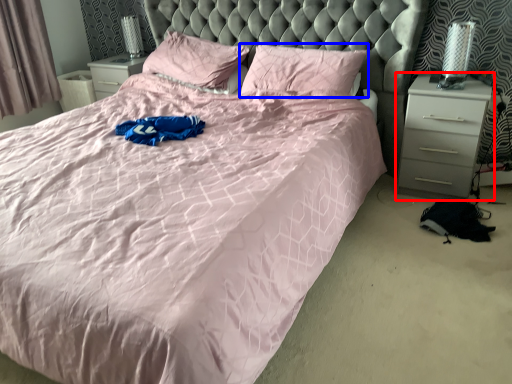
Question: Which object is closer to the camera taking this photo, nightstand (highlighted by a red box) or pillow (highlighted by a blue box)?

Choices:
 (A) nightstand
 (B) pillow

Answer: (A)